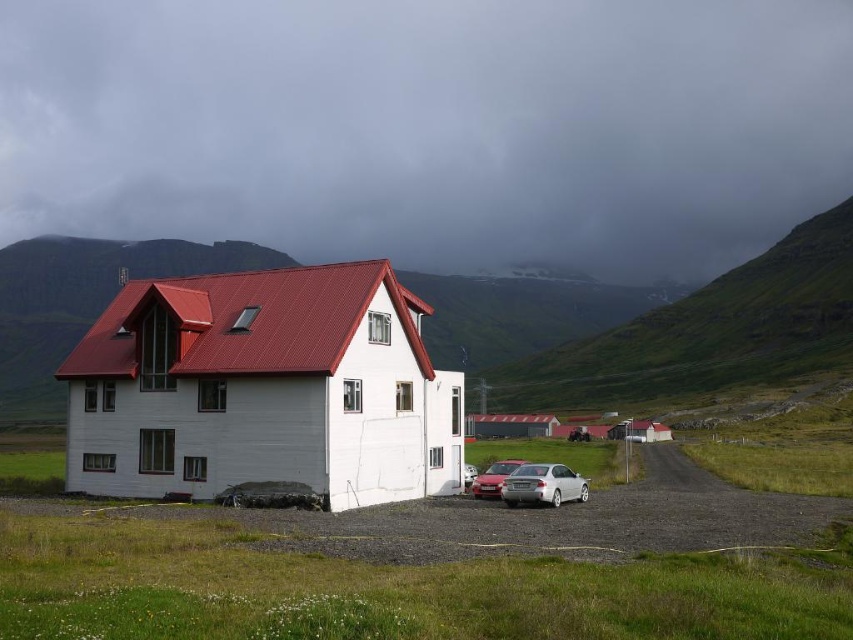
Question: Which of these objects is positioned farthest from the silver metallic car at lower center?

Choices:
 (A) satin silver sedan at lower center
 (B) green grassy hillside at center

Answer: (B)

Question: Among these points, which one is nearest to the camera?

Choices:
 (A) (515, 481)
 (B) (482, 497)

Answer: (A)

Question: Is green grassy hillside at center to the left of satin silver sedan at lower center from the viewer's perspective?

Choices:
 (A) no
 (B) yes

Answer: (A)

Question: From the image, what is the correct spatial relationship of green grassy hillside at center in relation to satin silver sedan at lower center?

Choices:
 (A) left
 (B) right

Answer: (B)

Question: Which point is closer to the camera?

Choices:
 (A) (718, 387)
 (B) (509, 461)
 (C) (550, 481)

Answer: (C)

Question: Does green grassy hillside at center have a greater width compared to satin silver sedan at lower center?

Choices:
 (A) no
 (B) yes

Answer: (B)